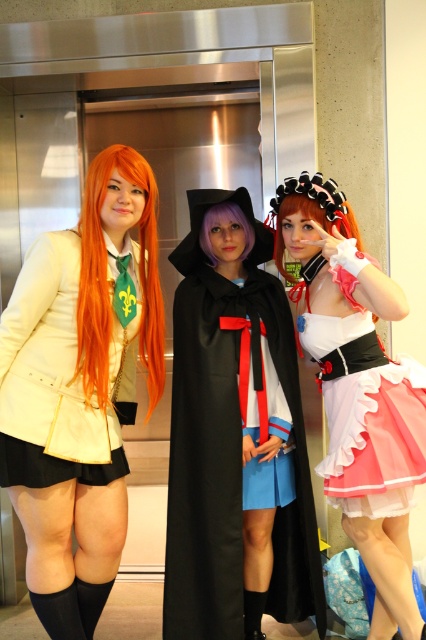
Looking at this image, you are organizing a costume party and need to store the matte white coat at center and the matte white dress at center in a closet. Which item will take up more space when folded and stored?

The matte white dress at center will take up more space when folded and stored because it occupies more space than the matte white coat at center according to the description.